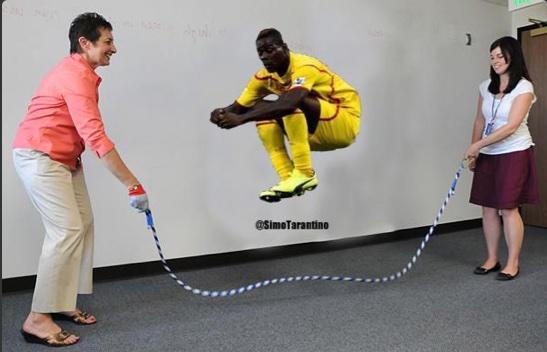
The width and height of the screenshot is (547, 352). Identify the location of wall. (183, 88).